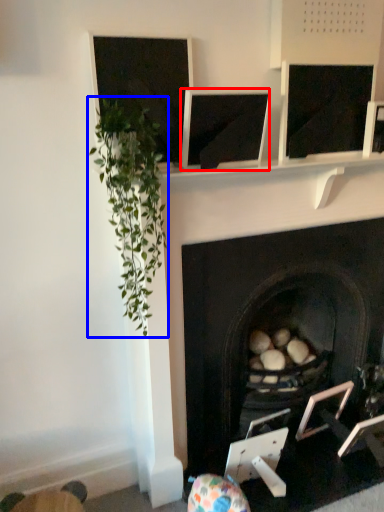
Question: Among these objects, which one is nearest to the camera, computer screen (highlighted by a red box) or plant (highlighted by a blue box)?

Choices:
 (A) computer screen
 (B) plant

Answer: (B)